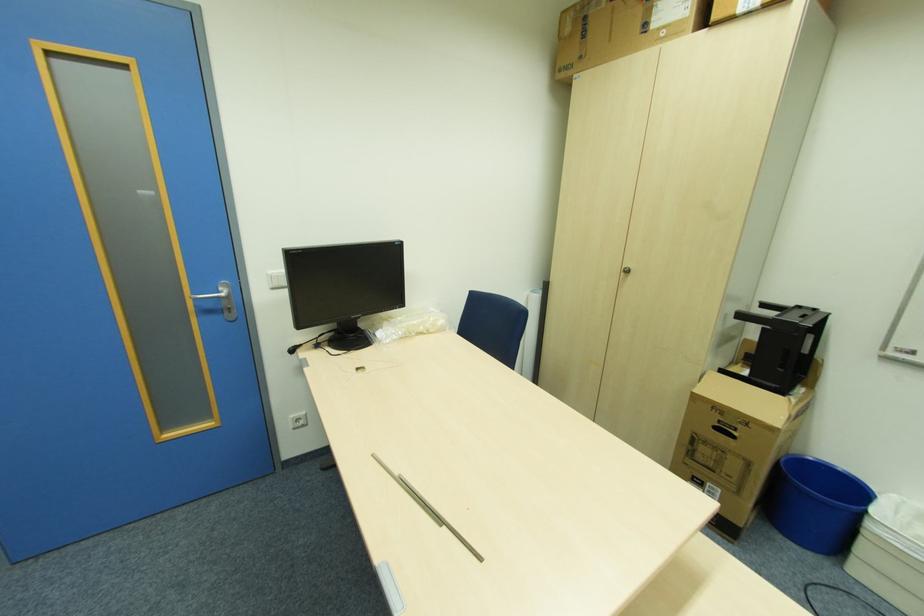
Where would you lift the cardboard box? Please return your answer as a coordinate pair (x, y).

(736, 428)